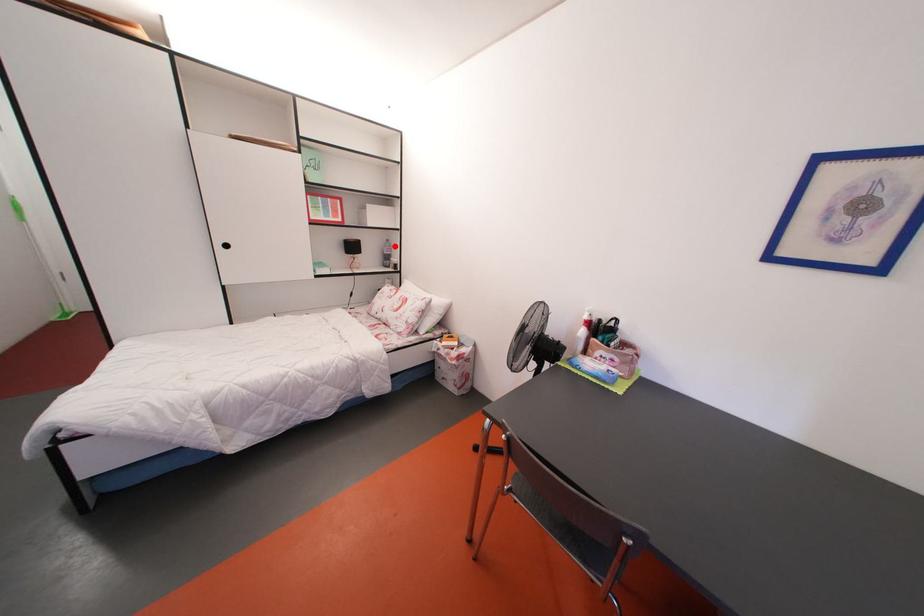
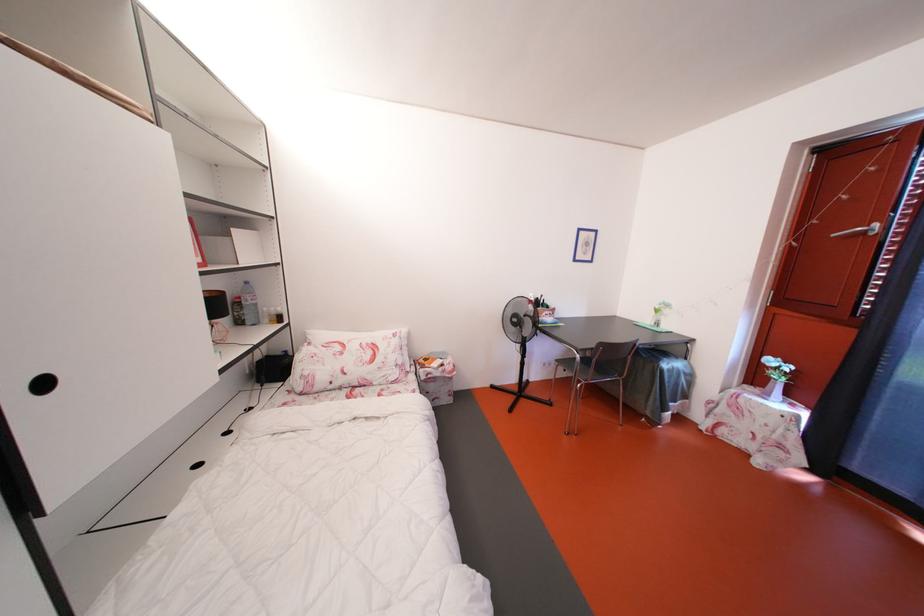
Question: I am providing you with two images of the same scene from different viewpoints. A red point is marked on the first image. At the location where the point appears in image 1, is it still visible in image 2?

Choices:
 (A) Yes
 (B) No

Answer: (A)